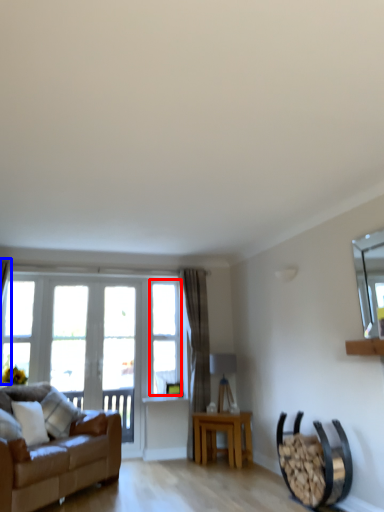
Question: Which of the following is the farthest to the observer, window (highlighted by a red box) or curtain (highlighted by a blue box)?

Choices:
 (A) window
 (B) curtain

Answer: (A)